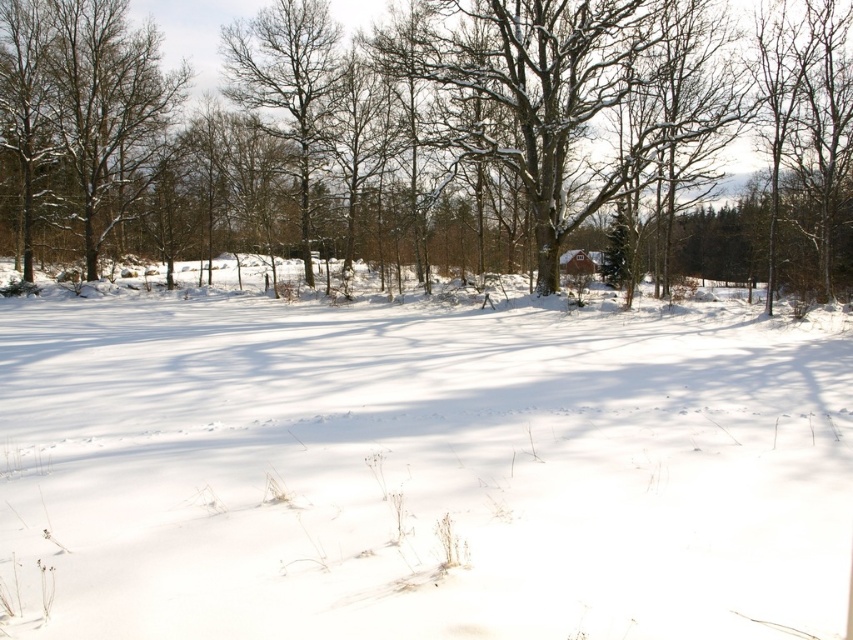
Question: Does snow-covered tree at left have a greater width compared to bare wood tree at center?

Choices:
 (A) no
 (B) yes

Answer: (B)

Question: Is snow-covered tree at left above bare wood tree at center?

Choices:
 (A) yes
 (B) no

Answer: (A)

Question: Which of these objects is positioned farthest from the bare wood tree at center?

Choices:
 (A) white fluffy snow at center
 (B) snow-covered tree at center

Answer: (A)

Question: Considering the real-world distances, which object is farthest from the white fluffy snow at center?

Choices:
 (A) snow-covered tree at center
 (B) snow-covered tree at left
 (C) bare wood tree at center

Answer: (B)

Question: Does white fluffy snow at center have a smaller size compared to bare wood tree at center?

Choices:
 (A) no
 (B) yes

Answer: (A)

Question: Which point is farther to the camera?

Choices:
 (A) (329, 67)
 (B) (134, 168)
 (C) (184, 566)

Answer: (B)